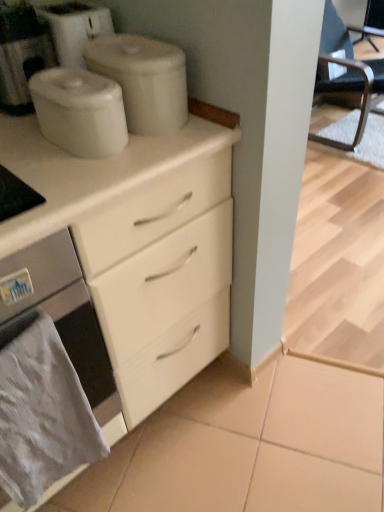
Where is `white matte coffee machine at upper left`? This screenshot has width=384, height=512. white matte coffee machine at upper left is located at coordinates (x=21, y=55).

What do you see at coordinates (42, 415) in the screenshot?
I see `gray fabric towel at lower left` at bounding box center [42, 415].

Image resolution: width=384 pixels, height=512 pixels. What do you see at coordinates (80, 112) in the screenshot? I see `white glossy container at upper center, acting as the 2th appliance starting from the back` at bounding box center [80, 112].

Identify the location of white matte coffee machine at upper left. tap(21, 55).

Is white glossy container at upper center, acting as the 2th appliance starting from the back, spatially inside white matte coffee machine at upper left, or outside of it?

white glossy container at upper center, acting as the 2th appliance starting from the back, is not inside white matte coffee machine at upper left, it's outside.

Considering the relative sizes of white glossy container at upper center, the 1th appliance viewed from the front, and white matte coffee machine at upper left in the image provided, is white glossy container at upper center, the 1th appliance viewed from the front, wider than white matte coffee machine at upper left?

No.

The image size is (384, 512). Find the location of `the 2nd appliance below the white matte coffee machine at upper left (from the image's perspective)`. the 2nd appliance below the white matte coffee machine at upper left (from the image's perspective) is located at coordinates (80, 112).

How different are the orientations of white matte coffee machine at upper left and black leather chair at right in degrees?

The facing directions of white matte coffee machine at upper left and black leather chair at right are 0.092 degrees apart.

Based on the photo, is white matte coffee machine at upper left oriented towards black leather chair at right?

No, white matte coffee machine at upper left is not aimed at black leather chair at right.

Looking at this image, would you say white matte coffee machine at upper left is a long distance from black leather chair at right?

That's right, there is a large distance between white matte coffee machine at upper left and black leather chair at right.

Is white matte coffee machine at upper left to the right of black leather chair at right from the viewer's perspective?

In fact, white matte coffee machine at upper left is to the left of black leather chair at right.

From a real-world perspective, is gray fabric towel at lower left positioned above or below white matte coffee machine at upper left?

From a real-world perspective, gray fabric towel at lower left is physically below white matte coffee machine at upper left.

Which is less distant, (36, 424) or (34, 61)?

Point (36, 424)

From the image's perspective, who appears lower, gray fabric towel at lower left or white matte coffee machine at upper left?

gray fabric towel at lower left appears lower in the image.

Considering the relative positions of gray fabric towel at lower left and white matte coffee machine at upper left in the image provided, is gray fabric towel at lower left to the left or to the right of white matte coffee machine at upper left?

Based on their positions, gray fabric towel at lower left is located to the right of white matte coffee machine at upper left.

Can you tell me how much satin white oven at lower left and gray fabric towel at lower left differ in facing direction?

They differ by 1.25 degrees in their facing directions.

Based on the photo, from the image's perspective, which one is positioned lower, satin white oven at lower left or gray fabric towel at lower left?

gray fabric towel at lower left appears lower in the image.

Which is in front, point (85, 349) or point (39, 448)?

Point (39, 448)

Considering the relative positions of satin white oven at lower left and gray fabric towel at lower left in the image provided, is satin white oven at lower left behind gray fabric towel at lower left?

No, satin white oven at lower left is in front of gray fabric towel at lower left.

Considering the sizes of gray fabric towel at lower left and white matte containers at upper center, the second appliance when ordered from front to back, in the image, is gray fabric towel at lower left taller or shorter than white matte containers at upper center, the second appliance when ordered from front to back,?

gray fabric towel at lower left is taller than white matte containers at upper center, the second appliance when ordered from front to back.

From a real-world perspective, is gray fabric towel at lower left on white matte containers at upper center, the second appliance when ordered from front to back?

No, from a real-world perspective, gray fabric towel at lower left is not over white matte containers at upper center, the second appliance when ordered from front to back

Is gray fabric towel at lower left at the left side of white matte containers at upper center, the second appliance when ordered from front to back?

Yes, gray fabric towel at lower left is to the left of white matte containers at upper center, the second appliance when ordered from front to back.

From the image's perspective, which is above, gray fabric towel at lower left or white matte containers at upper center, the second appliance when ordered from front to back?

From the image's view, white matte containers at upper center, the second appliance when ordered from front to back, is above.

Can you confirm if gray fabric towel at lower left is shorter than satin white oven at lower left?

Yes.

Which object is further away from the camera, gray fabric towel at lower left or satin white oven at lower left?

gray fabric towel at lower left is further away from the camera.

Looking at this image, from a real-world perspective, is gray fabric towel at lower left above or below satin white oven at lower left?

Result: From a real-world perspective, gray fabric towel at lower left is physically below satin white oven at lower left.

How different are the orientations of gray fabric towel at lower left and satin white oven at lower left in degrees?

The angular difference between gray fabric towel at lower left and satin white oven at lower left is 1.25 degrees.

Who is shorter, white matte coffee machine at upper left or satin white oven at lower left?

white matte coffee machine at upper left.

Does white matte coffee machine at upper left have a greater width compared to satin white oven at lower left?

No.

Is white matte coffee machine at upper left looking in the opposite direction of satin white oven at lower left?

white matte coffee machine at upper left is not turned away from satin white oven at lower left.

Based on the photo, is white matte coffee machine at upper left bigger than satin white oven at lower left?

No, white matte coffee machine at upper left is not bigger than satin white oven at lower left.

From the image's perspective, which appliance is the 2nd one below the white matte coffee machine at upper left? Please provide its 2D coordinates.

[(80, 112)]

Where is `coffee machine above the black leather chair at right (from a real-world perspective)`? The height and width of the screenshot is (512, 384). coffee machine above the black leather chair at right (from a real-world perspective) is located at coordinates (21, 55).

Looking at the image, which one is located further to black leather chair at right, gray fabric towel at lower left or white matte containers at upper center, the second appliance when ordered from front to back?

gray fabric towel at lower left lies further to black leather chair at right than the other object.

Which object lies nearer to the anchor point white glossy container at upper center, acting as the 2th appliance starting from the back, black leather chair at right or white matte coffee machine at upper left?

white matte coffee machine at upper left is positioned closer to the anchor white glossy container at upper center, acting as the 2th appliance starting from the back.

Consider the image. Estimate the real-world distances between objects in this image. Which object is further from black leather chair at right, satin white oven at lower left or white matte coffee machine at upper left?

satin white oven at lower left is further to black leather chair at right.

Which object lies further to the anchor point white matte coffee machine at upper left, white glossy container at upper center, the 1th appliance viewed from the front, or satin white oven at lower left?

satin white oven at lower left lies further to white matte coffee machine at upper left than the other object.

Estimate the real-world distances between objects in this image. Which object is closer to gray fabric towel at lower left, white matte containers at upper center, the second appliance when ordered from front to back, or satin white oven at lower left?

The object closer to gray fabric towel at lower left is satin white oven at lower left.

Estimate the real-world distances between objects in this image. Which object is further from white matte coffee machine at upper left, white matte containers at upper center, the 1th appliance viewed from the back, or black leather chair at right?

The object further to white matte coffee machine at upper left is black leather chair at right.

Based on their spatial positions, is satin white oven at lower left or white matte coffee machine at upper left closer to white glossy container at upper center, the 1th appliance viewed from the front?

The object closer to white glossy container at upper center, the 1th appliance viewed from the front, is white matte coffee machine at upper left.

From the image, which object appears to be nearer to white matte coffee machine at upper left, white matte containers at upper center, the second appliance when ordered from front to back, or satin white oven at lower left?

Among the two, white matte containers at upper center, the second appliance when ordered from front to back, is located nearer to white matte coffee machine at upper left.

At what (x,y) coordinates should I click in order to perform the action: click on appliance situated between white matte coffee machine at upper left and white matte containers at upper center, the 1th appliance viewed from the back, from left to right. Please return your answer as a coordinate pair (x, y). This screenshot has height=512, width=384. Looking at the image, I should click on (80, 112).

Identify the location of home appliance between white glossy container at upper center, acting as the 2th appliance starting from the back, and gray fabric towel at lower left vertically. (65, 320).

Where is `home appliance between white matte containers at upper center, the 1th appliance viewed from the back, and gray fabric towel at lower left vertically`? home appliance between white matte containers at upper center, the 1th appliance viewed from the back, and gray fabric towel at lower left vertically is located at coordinates (65, 320).

This screenshot has height=512, width=384. Identify the location of home appliance between black leather chair at right and gray fabric towel at lower left in the vertical direction. (65, 320).